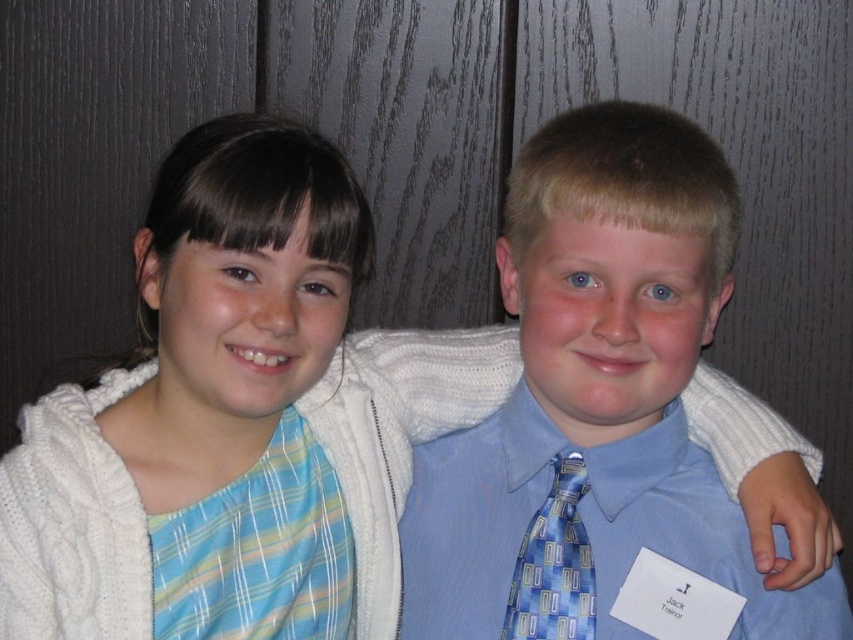
Question: Is blue satin tie at center further to the viewer compared to blue printed tie at center?

Choices:
 (A) yes
 (B) no

Answer: (B)

Question: In this image, where is blue satin tie at center located relative to blue printed tie at center?

Choices:
 (A) right
 (B) left

Answer: (A)

Question: Which point is closer to the camera?

Choices:
 (A) (544, 502)
 (B) (567, 458)

Answer: (A)

Question: Among these points, which one is farthest from the camera?

Choices:
 (A) (688, 125)
 (B) (537, 620)

Answer: (B)

Question: Does blue satin tie at center have a larger size compared to blue printed tie at center?

Choices:
 (A) yes
 (B) no

Answer: (A)